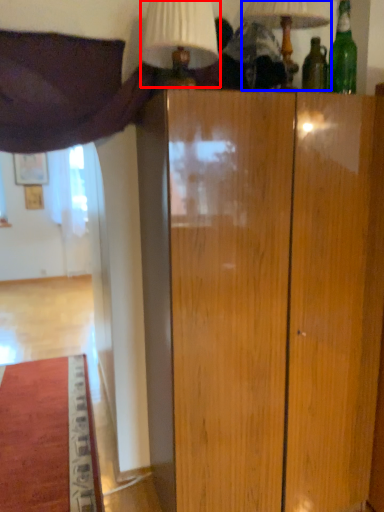
Question: Which object is further to the camera taking this photo, table lamp (highlighted by a red box) or table lamp (highlighted by a blue box)?

Choices:
 (A) table lamp
 (B) table lamp

Answer: (B)